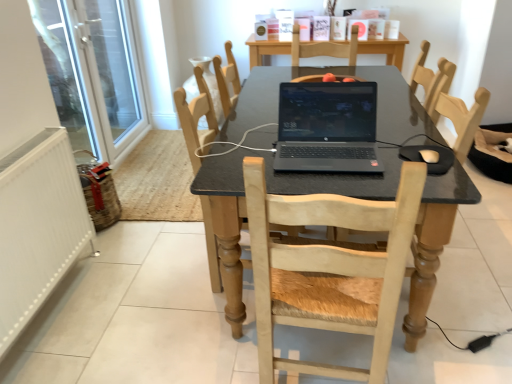
At what (x,y) coordinates should I click in order to perform the action: click on free location to the left of white matte mouse at lower right. Please return your answer as a coordinate pair (x, y). Image resolution: width=512 pixels, height=384 pixels. Looking at the image, I should click on (382, 163).